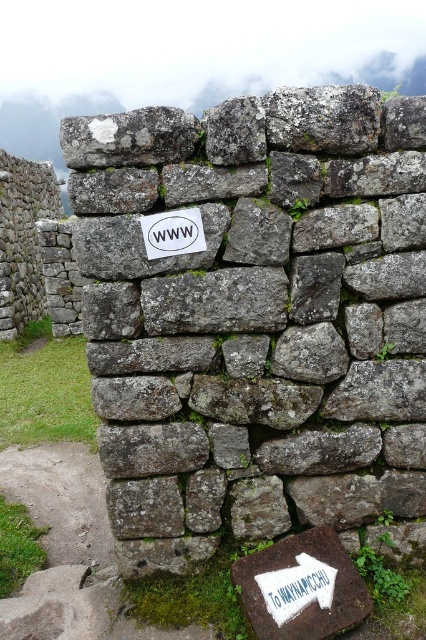
Question: Can you confirm if gray rough stone at center is thinner than white painted stone at lower right?

Choices:
 (A) no
 (B) yes

Answer: (A)

Question: Is white painted stone at lower right smaller than white paper sign at center?

Choices:
 (A) no
 (B) yes

Answer: (A)

Question: Which object is positioned closest to the white rough stone at upper center?

Choices:
 (A) white chalk arrow at lower center
 (B) gray rough stone at center
 (C) white painted stone at lower right
 (D) white paper sign at center

Answer: (D)

Question: Which object is positioned farthest from the gray rough stone at center?

Choices:
 (A) white paper sign at center
 (B) white chalk arrow at lower center

Answer: (B)

Question: Can you confirm if white rough stone at upper center is positioned to the right of white chalk arrow at lower center?

Choices:
 (A) yes
 (B) no

Answer: (B)

Question: Which object appears closest to the camera in this image?

Choices:
 (A) white rough stone at upper center
 (B) white paper sign at center
 (C) white painted stone at lower right

Answer: (C)